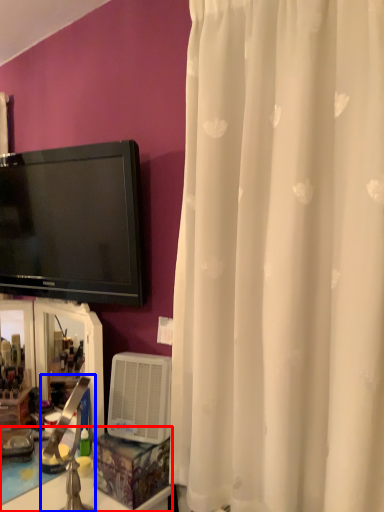
Question: Which of the following is the farthest to the observer, counter top (highlighted by a red box) or faucet (highlighted by a blue box)?

Choices:
 (A) counter top
 (B) faucet

Answer: (A)